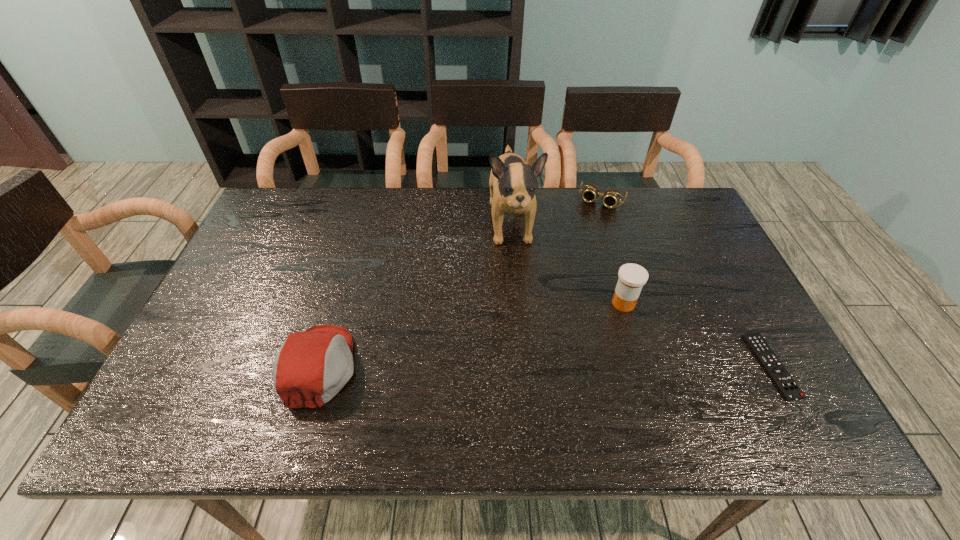
Identify the location of cap. This screenshot has width=960, height=540. (311, 367).

Identify the location of remote control. (784, 382).

In order to click on the shortest object in this screenshot , I will do `click(784, 382)`.

Identify the location of medicine. This screenshot has width=960, height=540. (632, 277).

At what (x,y) coordinates should I click in order to perform the action: click on the fourth object from right to left. Please return your answer as a coordinate pair (x, y). Image resolution: width=960 pixels, height=540 pixels. Looking at the image, I should click on (512, 182).

Locate an element on the screen. This screenshot has width=960, height=540. the tallest object is located at coordinates (512, 182).

Identify the location of the second shortest object. (611, 197).

This screenshot has height=540, width=960. Find the location of `vacant space situated 0.370m on the front-facing side of the cap`. vacant space situated 0.370m on the front-facing side of the cap is located at coordinates (516, 367).

Identify the location of vacant region located 0.350m on the back of the rightmost object. (705, 241).

Identify the location of blank space located 0.110m on the label of the third farthest object. (584, 329).